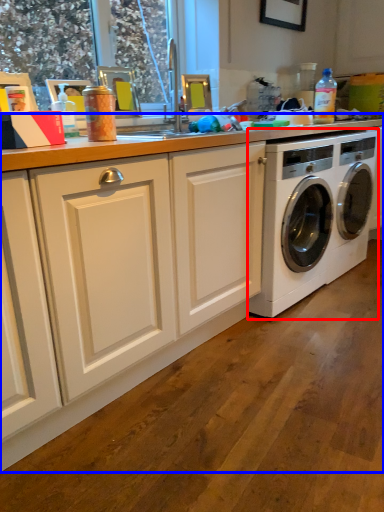
Question: Which object is closer to the camera taking this photo, washing machine (highlighted by a red box) or countertop (highlighted by a blue box)?

Choices:
 (A) washing machine
 (B) countertop

Answer: (B)